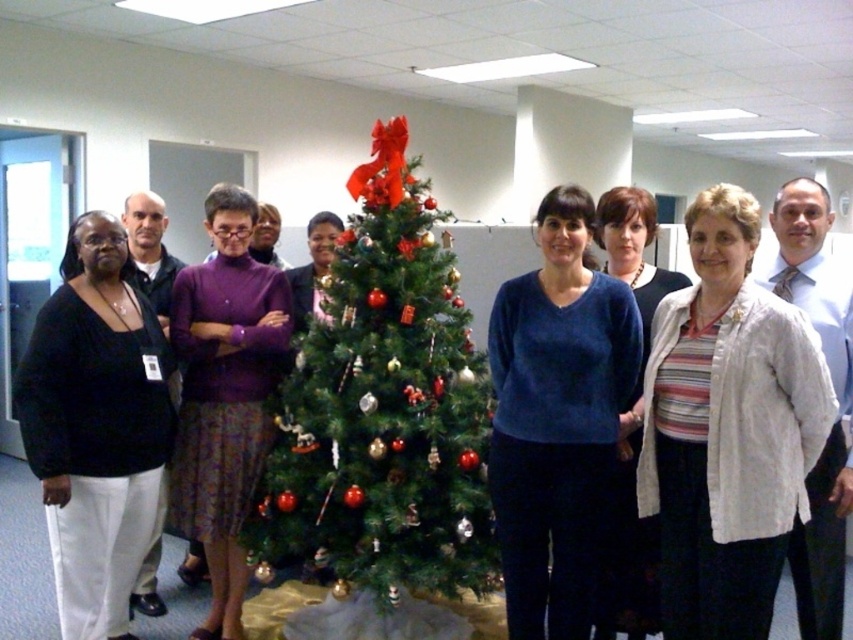
Question: Does green textured christmas tree at center appear over velvet blue sweater at center?

Choices:
 (A) no
 (B) yes

Answer: (B)

Question: Based on their relative distances, which object is nearer to the purple sweater at center?

Choices:
 (A) white fuzzy sweater at center
 (B) striped knit sweater at center
 (C) black matte sweater at left
 (D) green textured christmas tree at center

Answer: (D)

Question: Can you confirm if green textured christmas tree at center is wider than white fuzzy sweater at center?

Choices:
 (A) yes
 (B) no

Answer: (A)

Question: Which point appears closest to the camera in this image?

Choices:
 (A) (35, 406)
 (B) (622, 548)
 (C) (318, 240)

Answer: (A)

Question: Among these points, which one is farthest from the camera?

Choices:
 (A) (200, 349)
 (B) (645, 566)

Answer: (A)

Question: Can you confirm if striped knit shirt at center is positioned below black matte sweater at left?

Choices:
 (A) yes
 (B) no

Answer: (B)